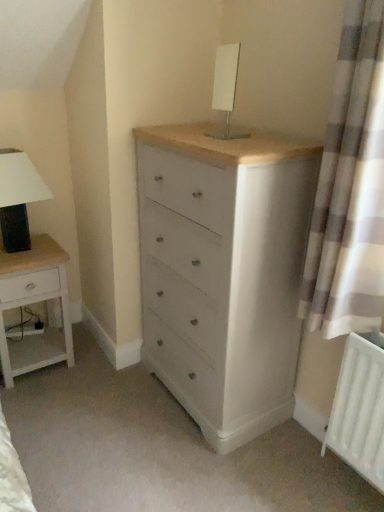
Where is `free space in front of white glossy table lamp at upper center, which appears as the 2th table lamp when viewed from the left`? Image resolution: width=384 pixels, height=512 pixels. free space in front of white glossy table lamp at upper center, which appears as the 2th table lamp when viewed from the left is located at coordinates (233, 144).